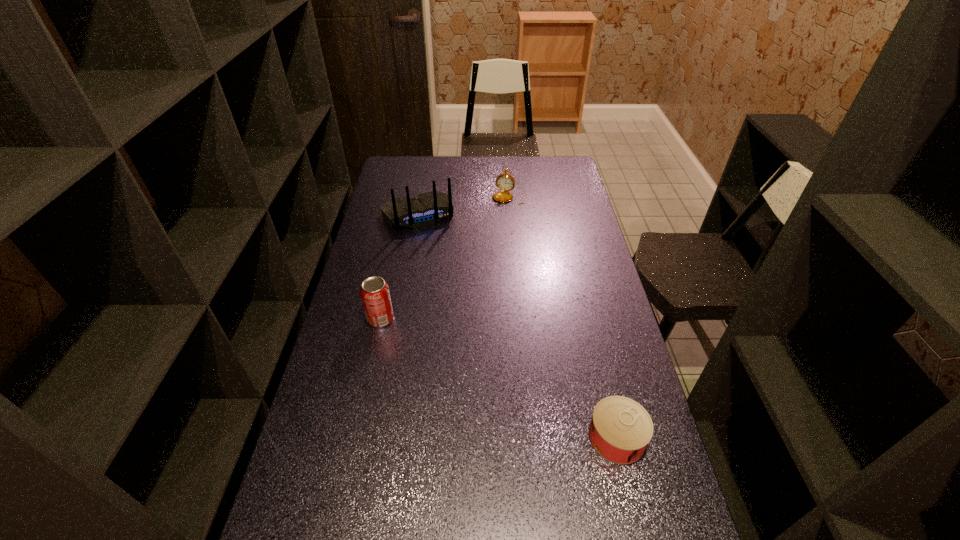
Locate an element on the screen. vacant space that's between the third tallest object and the tallest object is located at coordinates (464, 206).

The image size is (960, 540). Identify the location of empty location between the second shortest object and the third farthest object. (445, 258).

Locate which object ranks second in proximity to the router. Please provide its 2D coordinates. Your answer should be formatted as a tuple, i.e. [(x, y)], where the tuple contains the x and y coordinates of a point satisfying the conditions above.

[(375, 295)]

Locate an element on the screen. Image resolution: width=960 pixels, height=540 pixels. the third closest object relative to the router is located at coordinates (620, 430).

You are a GUI agent. You are given a task and a screenshot of the screen. Output one action in this format:
    pyautogui.click(x=<x>, y=<y>)
    Task: Click on the free space that satisfies the following two spatial constraints: 1. on the front side of the second nearest object; 2. on the left side of the nearest object
    This screenshot has height=540, width=960.
    Given the screenshot: What is the action you would take?
    pyautogui.click(x=355, y=437)

Image resolution: width=960 pixels, height=540 pixels. Find the location of `blank area in the image that satisfies the following two spatial constraints: 1. on the front side of the nearest object; 2. on the left side of the second shortest object`. blank area in the image that satisfies the following two spatial constraints: 1. on the front side of the nearest object; 2. on the left side of the second shortest object is located at coordinates (532, 437).

Identify the location of free region that satisfies the following two spatial constraints: 1. on the back side of the third farthest object; 2. on the left side of the tallest object. (403, 215).